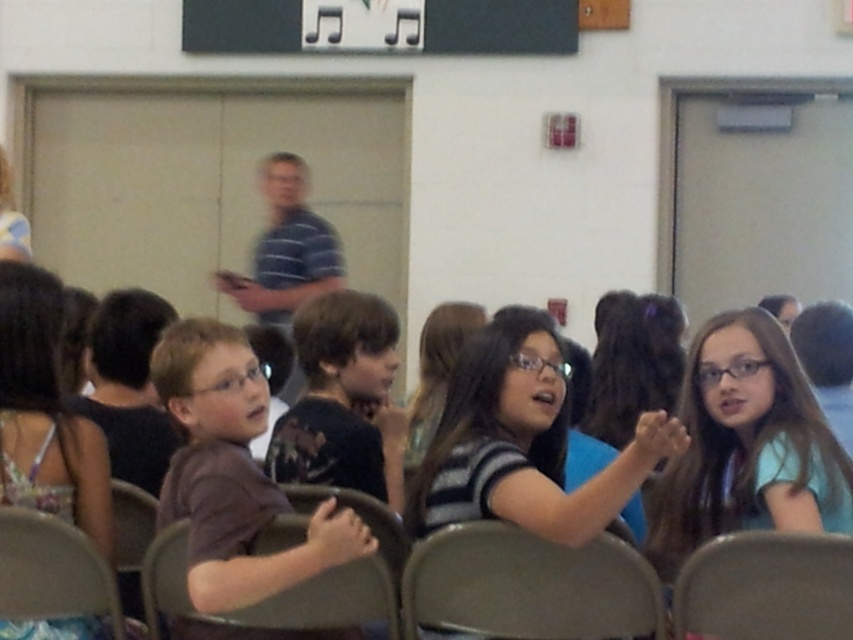
Question: In this image, where is black matte music notes at upper center located relative to metallic gray chair at lower right?

Choices:
 (A) right
 (B) left

Answer: (B)

Question: Does metallic gray chair at center appear on the left side of metallic gray chair at lower left?

Choices:
 (A) no
 (B) yes

Answer: (A)

Question: Which object is positioned closest to the metallic gray chair at center?

Choices:
 (A) brown matte shirt at center
 (B) metallic gray chair at lower right
 (C) gray fabric chair at center
 (D) black matte music notes at upper center

Answer: (B)

Question: Does metallic gray chair at lower right have a lesser width compared to gray plastic chair at lower left?

Choices:
 (A) no
 (B) yes

Answer: (A)

Question: Which object appears closest to the camera in this image?

Choices:
 (A) metallic gray chair at lower left
 (B) gray fabric chair at center
 (C) metallic gray chair at lower right

Answer: (C)

Question: Which object appears closest to the camera in this image?

Choices:
 (A) metallic gray chair at lower left
 (B) black matte music notes at upper center
 (C) metallic gray chair at center

Answer: (C)